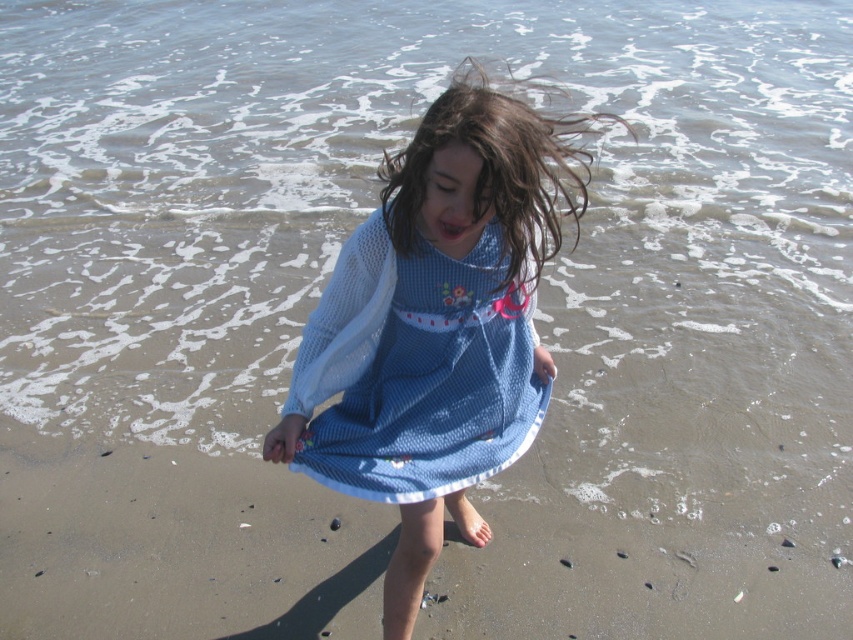
Can you confirm if blue mesh dress at center is wider than wet brown hair at center?

No, blue mesh dress at center is not wider than wet brown hair at center.

Is blue mesh dress at center bigger than wet brown hair at center?

Incorrect, blue mesh dress at center is not larger than wet brown hair at center.

Image resolution: width=853 pixels, height=640 pixels. What do you see at coordinates (415, 371) in the screenshot?
I see `blue mesh dress at center` at bounding box center [415, 371].

Where is `blue mesh dress at center`? This screenshot has height=640, width=853. blue mesh dress at center is located at coordinates (415, 371).

Is point (471, 321) farther from viewer compared to point (515, 269)?

Yes, it is behind point (515, 269).

Can you confirm if blue woven dress at center is smaller than wet brown hair at center?

No.

What do you see at coordinates (439, 326) in the screenshot? I see `blue woven dress at center` at bounding box center [439, 326].

The width and height of the screenshot is (853, 640). Find the location of `blue woven dress at center`. blue woven dress at center is located at coordinates (439, 326).

Can you confirm if blue woven dress at center is positioned below blue mesh dress at center?

Indeed, blue woven dress at center is positioned under blue mesh dress at center.

Does point (392, 378) lie behind point (402, 477)?

Yes, it is behind point (402, 477).

Who is more distant from viewer, (450,125) or (390,273)?

Point (390,273)

Identify the location of blue woven dress at center. (439, 326).